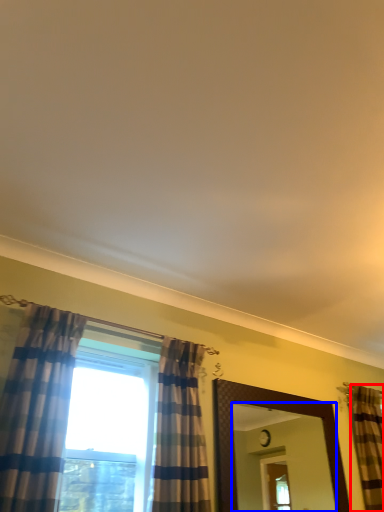
Question: Which point is closer to the camera, curtain (highlighted by a red box) or mirror (highlighted by a blue box)?

Choices:
 (A) curtain
 (B) mirror

Answer: (B)